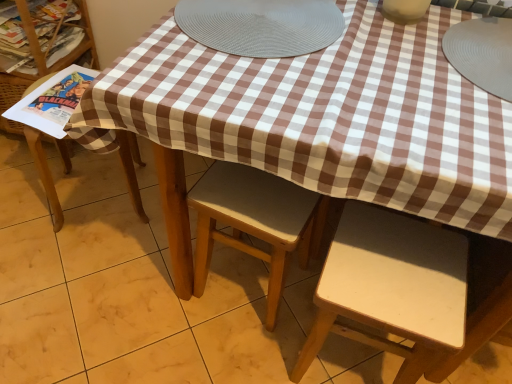
Question: Is light brown wood chair at center, which is counted as the 2th chair, starting from the right, next to matte white vase at upper center, which is the 2th tableware from right to left, and touching it?

Choices:
 (A) no
 (B) yes

Answer: (A)

Question: Can you confirm if light brown wood chair at center, which is counted as the 2th chair, starting from the right, is wider than matte white vase at upper center, the 1th tableware viewed from the left?

Choices:
 (A) no
 (B) yes

Answer: (B)

Question: Considering the relative sizes of light brown wood chair at center, which is counted as the 2th chair, starting from the right, and matte white vase at upper center, which is the 2th tableware from right to left, in the image provided, is light brown wood chair at center, which is counted as the 2th chair, starting from the right, shorter than matte white vase at upper center, which is the 2th tableware from right to left,?

Choices:
 (A) yes
 (B) no

Answer: (B)

Question: From the image's perspective, would you say light brown wood chair at center, which is counted as the 2th chair, starting from the right, is shown under matte white vase at upper center, which is the 2th tableware from right to left?

Choices:
 (A) no
 (B) yes

Answer: (B)

Question: Does light brown wood chair at center, which is counted as the 2th chair, starting from the right, appear on the right side of matte white vase at upper center, the 1th tableware viewed from the left?

Choices:
 (A) no
 (B) yes

Answer: (A)

Question: In terms of width, does matte white vase at upper center, which is the 2th tableware from right to left, look wider or thinner when compared to gray rubber placemat at upper right, the second tableware positioned from the left?

Choices:
 (A) thin
 (B) wide

Answer: (A)

Question: Is matte white vase at upper center, which is the 2th tableware from right to left, inside or outside of gray rubber placemat at upper right, the 1th tableware viewed from the right?

Choices:
 (A) inside
 (B) outside

Answer: (B)

Question: From a real-world perspective, relative to gray rubber placemat at upper right, the second tableware positioned from the left, is matte white vase at upper center, which is the 2th tableware from right to left, vertically above or below?

Choices:
 (A) above
 (B) below

Answer: (A)

Question: Considering the positions of point (391, 4) and point (488, 39), is point (391, 4) closer or farther from the camera than point (488, 39)?

Choices:
 (A) closer
 (B) farther

Answer: (A)

Question: Looking at their shapes, would you say matte paper magazine at left is wider or thinner than matte white vase at upper center, the 1th tableware viewed from the left?

Choices:
 (A) thin
 (B) wide

Answer: (B)

Question: Based on their positions, is matte paper magazine at left located to the left or right of matte white vase at upper center, which is the 2th tableware from right to left?

Choices:
 (A) right
 (B) left

Answer: (B)

Question: Is matte paper magazine at left bigger or smaller than matte white vase at upper center, which is the 2th tableware from right to left?

Choices:
 (A) big
 (B) small

Answer: (B)

Question: Choose the correct answer: Is matte paper magazine at left inside matte white vase at upper center, which is the 2th tableware from right to left, or outside it?

Choices:
 (A) outside
 (B) inside

Answer: (A)

Question: Based on their positions, is gray textured placemat at center located to the left or right of white matte chair at lower right, placed as the 1th chair when sorted from right to left?

Choices:
 (A) left
 (B) right

Answer: (A)

Question: From a real-world perspective, is gray textured placemat at center physically located above or below white matte chair at lower right, placed as the 1th chair when sorted from right to left?

Choices:
 (A) below
 (B) above

Answer: (B)